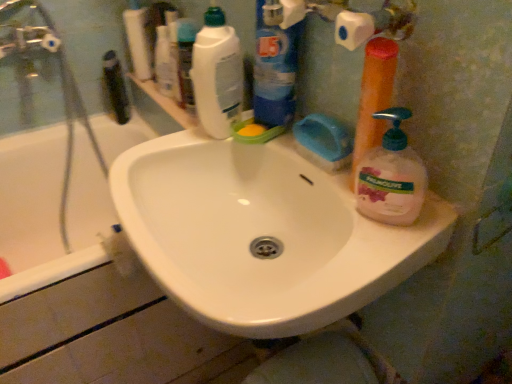
Question: Could you tell me if orange plastic pump bottle at right, which is the second cleaning product in right-to-left order, is turned towards blue plastic bottle at upper center, the third cleaning product in the right-to-left sequence?

Choices:
 (A) no
 (B) yes

Answer: (A)

Question: Does orange plastic pump bottle at right, which is the second cleaning product in right-to-left order, appear on the right side of blue plastic bottle at upper center, the third cleaning product in the right-to-left sequence?

Choices:
 (A) no
 (B) yes

Answer: (B)

Question: Is orange plastic pump bottle at right, which is the second cleaning product in right-to-left order, positioned before blue plastic bottle at upper center, the 2th cleaning product when ordered from left to right?

Choices:
 (A) no
 (B) yes

Answer: (B)

Question: From a real-world perspective, is orange plastic pump bottle at right, which is the second cleaning product in right-to-left order, positioned under blue plastic bottle at upper center, the 2th cleaning product when ordered from left to right, based on gravity?

Choices:
 (A) yes
 (B) no

Answer: (A)

Question: Is orange plastic pump bottle at right, the third cleaning product viewed from the left, thinner than blue plastic bottle at upper center, the 2th cleaning product when ordered from left to right?

Choices:
 (A) no
 (B) yes

Answer: (B)

Question: From the image's perspective, is white glossy bottle at upper center, acting as the 1th toiletry starting from the front, located above or below white glossy bathtub at left?

Choices:
 (A) above
 (B) below

Answer: (A)

Question: Considering their positions, is white glossy bottle at upper center, acting as the 1th toiletry starting from the front, located in front of or behind white glossy bathtub at left?

Choices:
 (A) front
 (B) behind

Answer: (B)

Question: From a real-world perspective, relative to white glossy bathtub at left, is white glossy bottle at upper center, the second toiletry from the left, vertically above or below?

Choices:
 (A) above
 (B) below

Answer: (A)

Question: Considering the positions of white glossy bottle at upper center, positioned as the second toiletry in back-to-front order, and white glossy bathtub at left in the image, is white glossy bottle at upper center, positioned as the second toiletry in back-to-front order, taller or shorter than white glossy bathtub at left?

Choices:
 (A) short
 (B) tall

Answer: (A)

Question: Is white glossy sink at center in front of or behind pink translucent liquid soap at right, which ranks as the 1th cleaning product in right-to-left order, in the image?

Choices:
 (A) front
 (B) behind

Answer: (A)

Question: Based on their positions, is white glossy sink at center located to the left or right of pink translucent liquid soap at right, which ranks as the 1th cleaning product in right-to-left order?

Choices:
 (A) right
 (B) left

Answer: (B)

Question: In terms of height, does white glossy sink at center look taller or shorter compared to pink translucent liquid soap at right, which ranks as the 1th cleaning product in right-to-left order?

Choices:
 (A) short
 (B) tall

Answer: (B)

Question: Looking at the image, does white glossy sink at center seem bigger or smaller compared to pink translucent liquid soap at right, which ranks as the 1th cleaning product in right-to-left order?

Choices:
 (A) small
 (B) big

Answer: (B)

Question: Considering their positions, is pink translucent liquid soap at right, arranged as the fourth cleaning product when viewed from the left, located in front of or behind white glossy sink at center?

Choices:
 (A) front
 (B) behind

Answer: (B)

Question: Considering the positions of pink translucent liquid soap at right, which ranks as the 1th cleaning product in right-to-left order, and white glossy sink at center in the image, is pink translucent liquid soap at right, which ranks as the 1th cleaning product in right-to-left order, taller or shorter than white glossy sink at center?

Choices:
 (A) tall
 (B) short

Answer: (B)